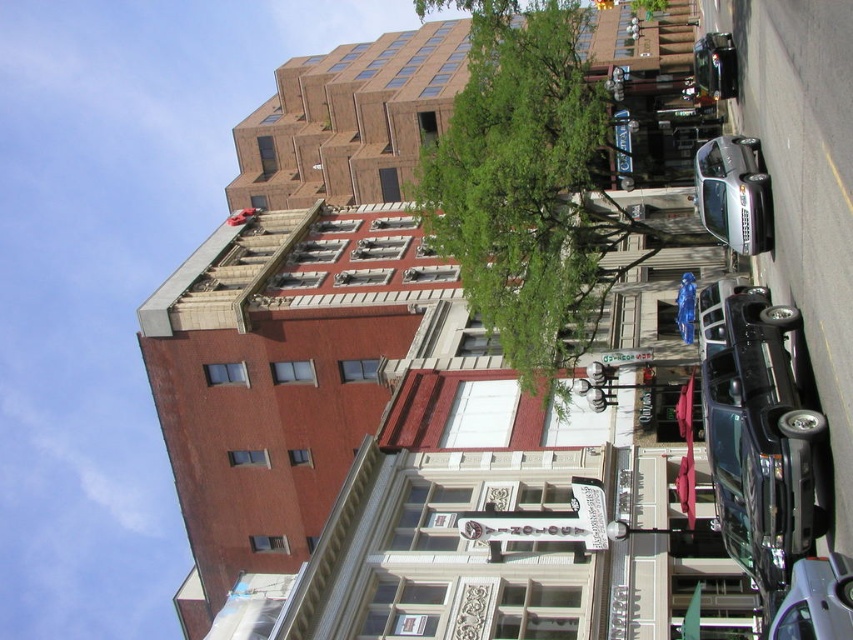
Which of these two, green leafy tree at center or shiny black car at right, stands taller?

Standing taller between the two is green leafy tree at center.

Who is positioned more to the left, green leafy tree at center or shiny black car at right?

green leafy tree at center

Is point (419, 200) positioned before point (781, 307)?

No.

Identify the location of green leafy tree at center. (524, 184).

Does silver metallic sedan at right have a lesser width compared to metallic silver sedan at lower right?

No, silver metallic sedan at right is not thinner than metallic silver sedan at lower right.

In the scene shown: Who is higher up, silver metallic sedan at right or metallic silver sedan at lower right?

silver metallic sedan at right is higher up.

Does point (756, 196) lie behind point (775, 621)?

Yes, it is.

Image resolution: width=853 pixels, height=640 pixels. In order to click on silver metallic sedan at right in this screenshot , I will do `click(734, 193)`.

Is green leafy tree at center behind silver metallic sedan at right?

Yes, it is.

How much distance is there between green leafy tree at center and silver metallic sedan at right?

A distance of 33.40 feet exists between green leafy tree at center and silver metallic sedan at right.

Find the location of a particular element. The image size is (853, 640). green leafy tree at center is located at coordinates (524, 184).

Locate an element on the screen. This screenshot has height=640, width=853. green leafy tree at center is located at coordinates (524, 184).